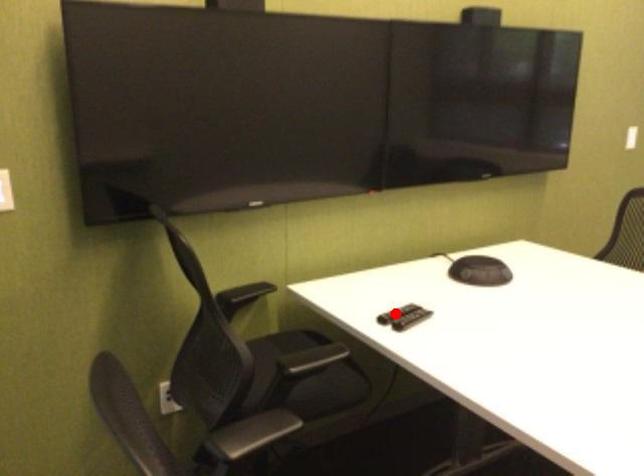
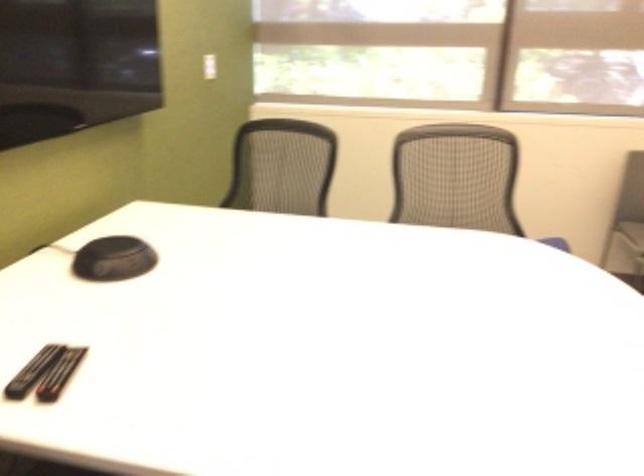
Where in the second image is the point corresponding to the highlighted location from the first image?

(32, 371)